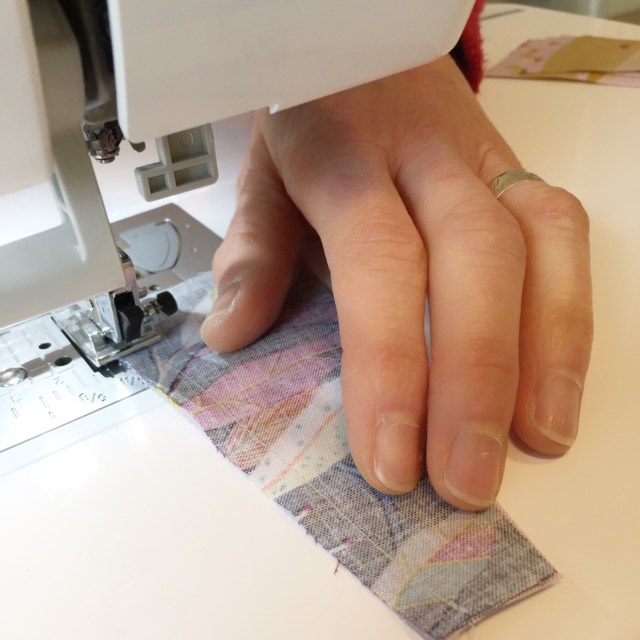
Where is `background behind table`? The height and width of the screenshot is (640, 640). background behind table is located at coordinates (630, 10), (593, 9).